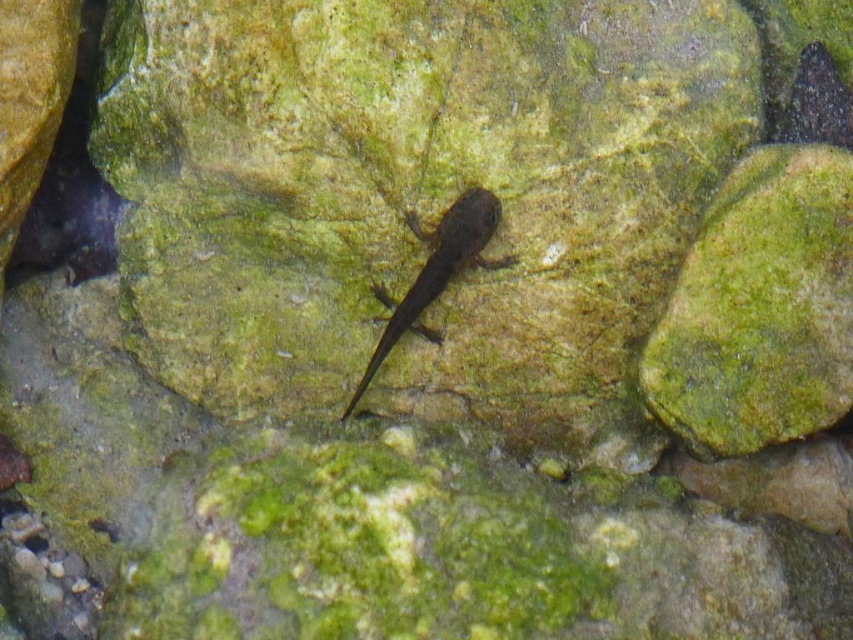
You are a researcher studying the habitat of the dark brown smooth salamander at center. Based on the scene description, where would you expect to find this salamander in its natural environment?

The dark brown smooth salamander at center is located at point (x=436, y=272), which corresponds to the center of the mossy rock in a damp environment like a shallow stream or pond.

You are a photographer trying to capture a closeup of the amphibian on the mossy rock. You are currently standing at a point 5 feet away from the amphibian. If you move forward to the point at coordinates point (415, 289), will you be closer to the amphibian than before?

The distance of point (415, 289) from camera is 4.37 feet, so moving to that point will bring you closer to the amphibian since 4.37 feet is less than 5 feet.

You are a researcher observing the scene. You need to determine which animal is taller between the dark brown smooth salamander at center and the shiny black fish at upper right. Based on the scene, which one is taller?

The dark brown smooth salamander at center is taller than the shiny black fish at upper right.